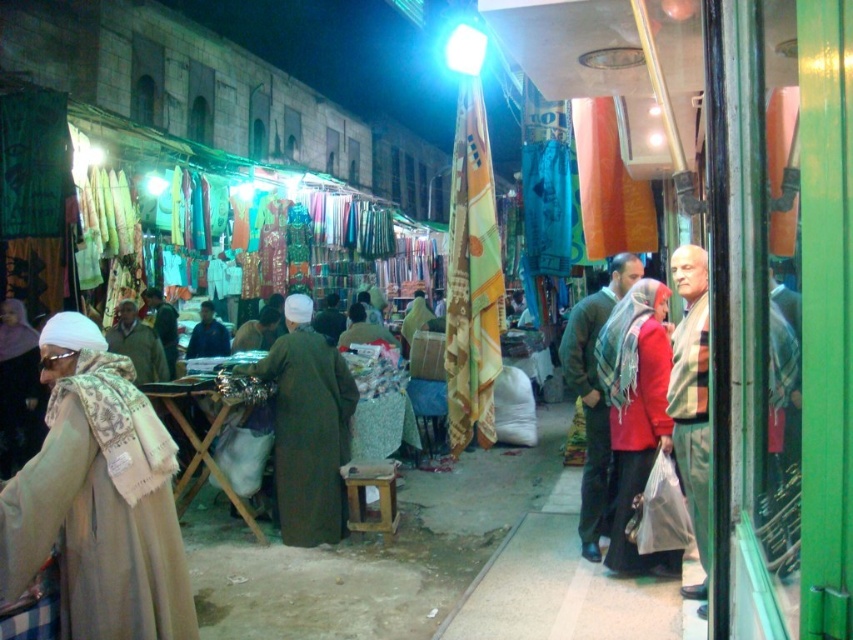
Can you confirm if light brown fabric at right is bigger than brown woolen jacket at center?

Incorrect, light brown fabric at right is not larger than brown woolen jacket at center.

Between light brown fabric at right and brown woolen jacket at center, which one is positioned higher?

brown woolen jacket at center is above.

Who is more forward, (694, 292) or (144, 371)?

Point (694, 292) is more forward.

Find the location of `light brown fabric at right`. light brown fabric at right is located at coordinates (691, 396).

This screenshot has width=853, height=640. What do you see at coordinates (593, 394) in the screenshot? I see `green woolen sweater at center` at bounding box center [593, 394].

Who is more distant from viewer, (593, 298) or (201, 324)?

Point (201, 324)

Is point (596, 317) less distant than point (202, 337)?

That is True.

Locate an element on the screen. This screenshot has width=853, height=640. green woolen sweater at center is located at coordinates (593, 394).

Measure the distance between brown woolen robe at center and camera.

brown woolen robe at center and camera are 19.20 feet apart from each other.

Can you confirm if brown woolen robe at center is taller than dark blue fabric at center?

Yes, brown woolen robe at center is taller than dark blue fabric at center.

Who is more forward, (289, 316) or (184, 355)?

Positioned in front is point (289, 316).

The height and width of the screenshot is (640, 853). I want to click on brown woolen robe at center, so click(x=308, y=428).